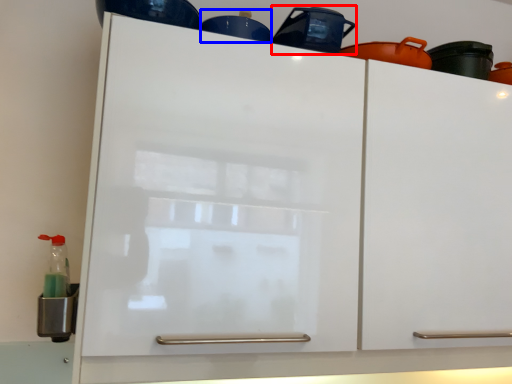
Question: Among these objects, which one is farthest to the camera, appliance (highlighted by a red box) or appliance (highlighted by a blue box)?

Choices:
 (A) appliance
 (B) appliance

Answer: (B)